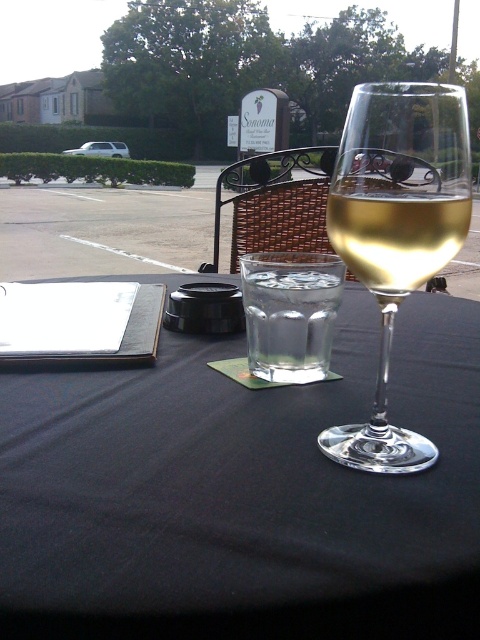
Question: Which object is closer to the camera taking this photo?

Choices:
 (A) clear glass wine at center
 (B) clear glass table at center
 (C) clear glass wine glass at center

Answer: (B)

Question: Does clear glass table at center have a smaller size compared to clear glass wine glass at center?

Choices:
 (A) no
 (B) yes

Answer: (A)

Question: Can you confirm if clear glass wine glass at center is bigger than clear glass wine at center?

Choices:
 (A) yes
 (B) no

Answer: (A)

Question: Based on their relative distances, which object is farther from the clear glass wine at center?

Choices:
 (A) clear glass table at center
 (B) clear glass wine glass at center

Answer: (A)

Question: Which of these objects is positioned farthest from the clear glass wine glass at center?

Choices:
 (A) clear glass table at center
 (B) clear glass wine at center

Answer: (A)

Question: Can you confirm if clear glass wine glass at center is positioned below clear glass wine at center?

Choices:
 (A) yes
 (B) no

Answer: (A)